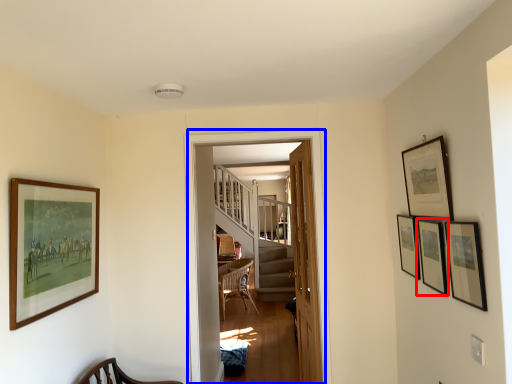
Question: Which point is further to the camera, picture frame (highlighted by a red box) or corridor (highlighted by a blue box)?

Choices:
 (A) picture frame
 (B) corridor

Answer: (B)